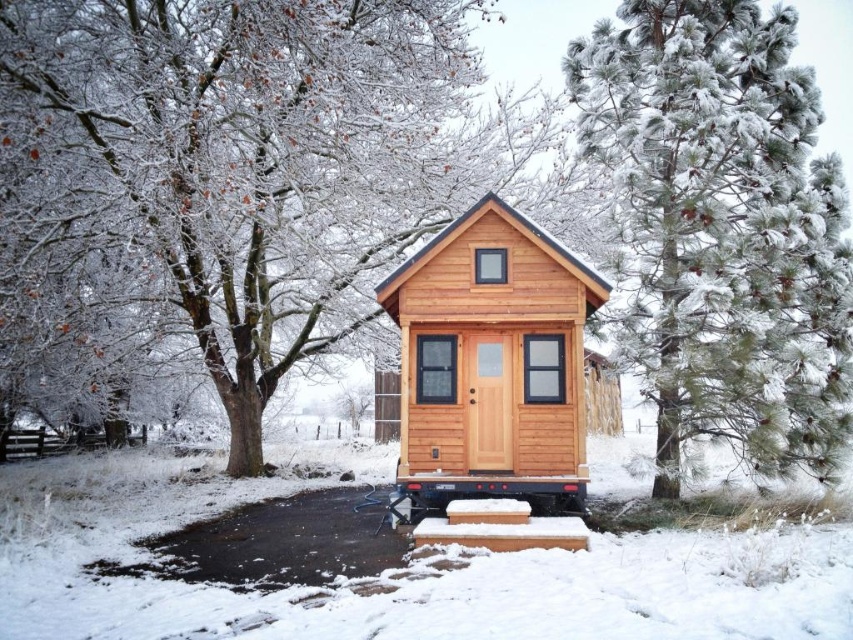
Question: Which point is farther to the camera?

Choices:
 (A) (827, 221)
 (B) (354, 259)
 (C) (521, 337)

Answer: (B)

Question: Is snow-covered bark tree at upper left bigger than natural wood cabin at center?

Choices:
 (A) no
 (B) yes

Answer: (B)

Question: Among these objects, which one is nearest to the camera?

Choices:
 (A) snow-covered pine tree at right
 (B) snow-covered bark tree at upper left
 (C) natural wood cabin at center

Answer: (B)

Question: Is snow-covered bark tree at upper left to the left of snow-covered pine tree at right from the viewer's perspective?

Choices:
 (A) yes
 (B) no

Answer: (A)

Question: Which point is farther to the camera?

Choices:
 (A) natural wood cabin at center
 (B) snow-covered pine tree at right
 (C) snow-covered bark tree at upper left

Answer: (B)

Question: Can you confirm if snow-covered pine tree at right is bigger than natural wood cabin at center?

Choices:
 (A) no
 (B) yes

Answer: (A)